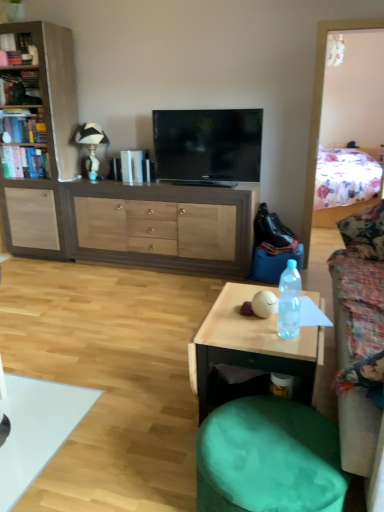
The image size is (384, 512). What are the coordinates of `free point below flat screen tv at center (from a real-world perspective)` in the screenshot? It's located at (205, 182).